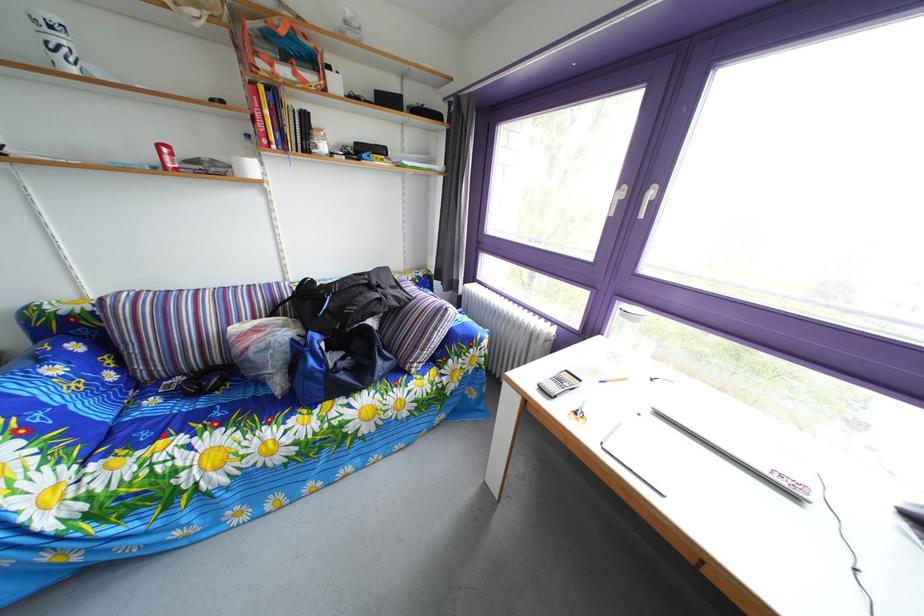
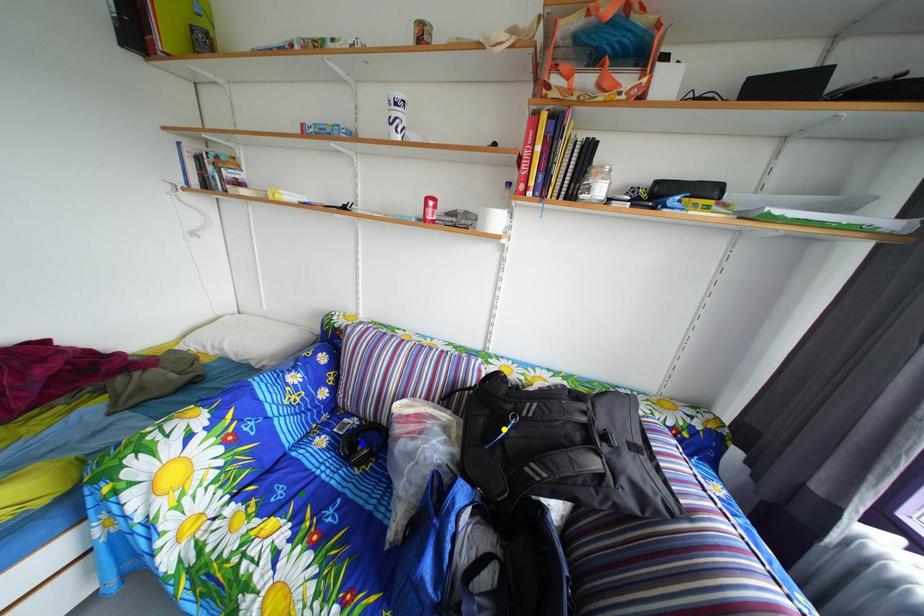
Question: I am providing you with two images of the same scene from different viewpoints. A red point is marked on the first image. You are given multiple points on the second image. Which point in image 2 is actually the same real-world point as the red point in image 1?

Choices:
 (A) blue point
 (B) green point
 (C) yellow point

Answer: (B)